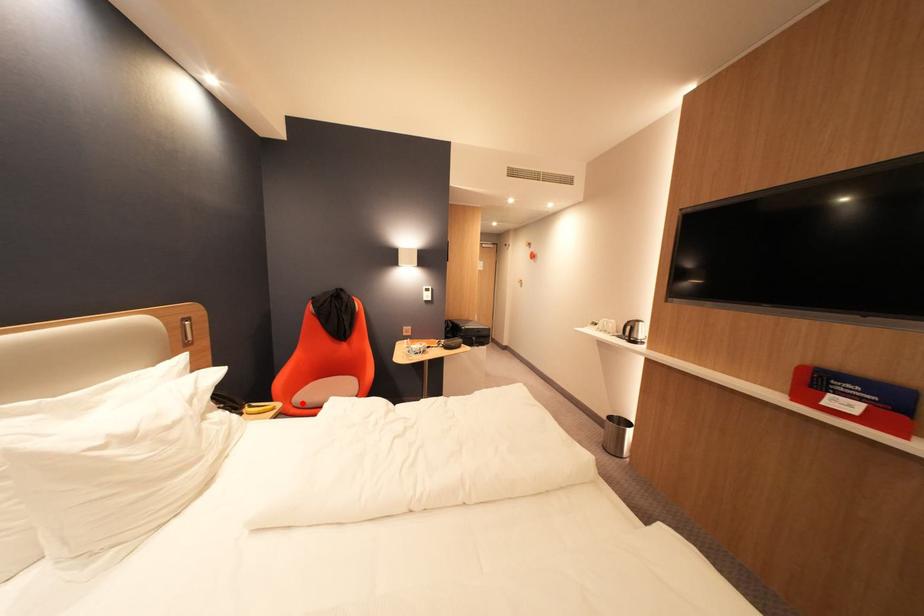
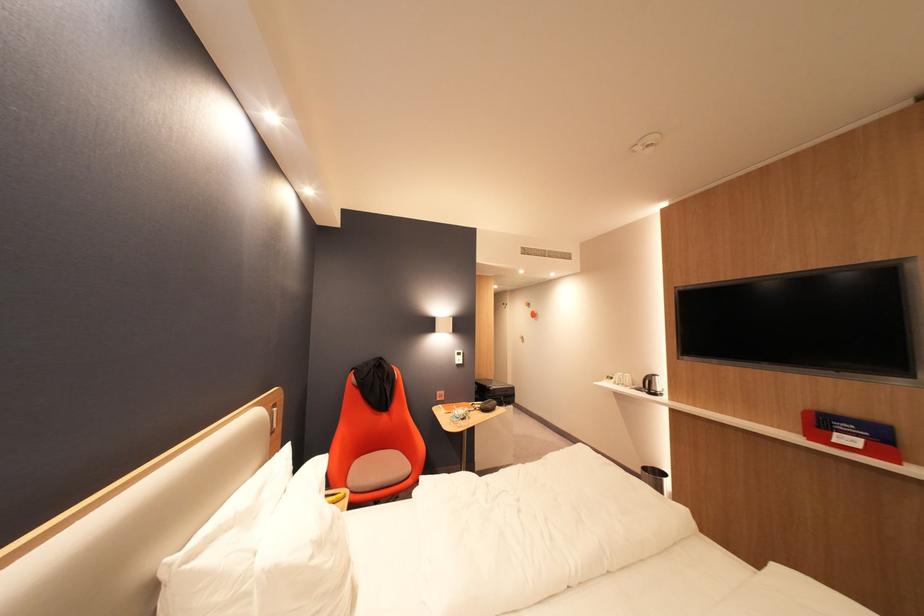
Question: I am providing you with two images of the same scene from different viewpoints. A red point is shown in image1. For the corresponding object point in image2, is it positioned nearer or farther from the camera?

Choices:
 (A) Nearer
 (B) Farther

Answer: (A)